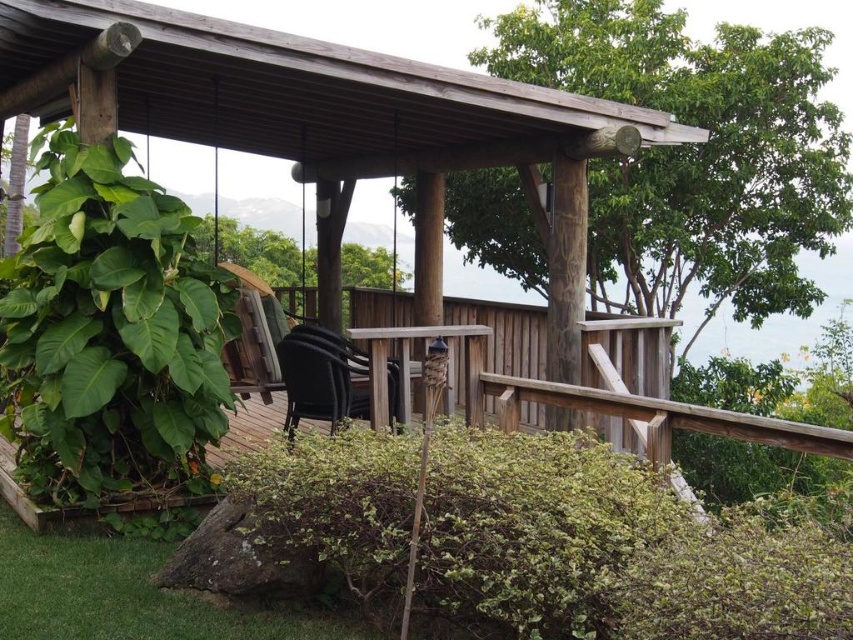
You are planning to install a new bench in the middle of the wooden gazebo at center and the green leafy tree at center. The bench is 6 feet long. Will there be enough space between them to place the bench horizontally?

The distance between the wooden gazebo at center and the green leafy tree at center is 12.55 feet. Since the bench is 6 feet long, there is sufficient space to place it horizontally between them as 6 feet is less than half of 12.55 feet. However, this calculation assumes the bench is placed exactly in the middle, so there would be approximately 3.275 feet of space on each side. Therefore, yes, the bench can fit.

Based on the photo, you are planning to install a new lighting system for the wooden gazebo at center and the green leafy tree at center. Since you want to ensure that the lights can reach both objects adequately, which object requires taller light poles to illuminate properly?

The wooden gazebo at center is taller than the green leafy tree at center, so the wooden gazebo at center requires taller light poles to illuminate properly.